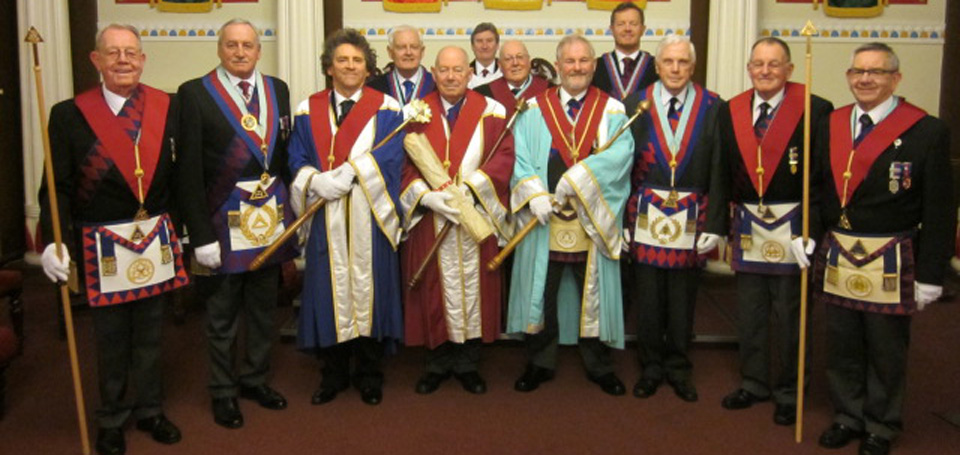
Where is `hoods`? Image resolution: width=960 pixels, height=455 pixels. hoods is located at coordinates coord(874,145), coord(781,148), coord(674,152), coord(592,121), coord(466,133), coord(360,133), coord(276,119), coord(150,150), coord(629,80), coord(422,85).